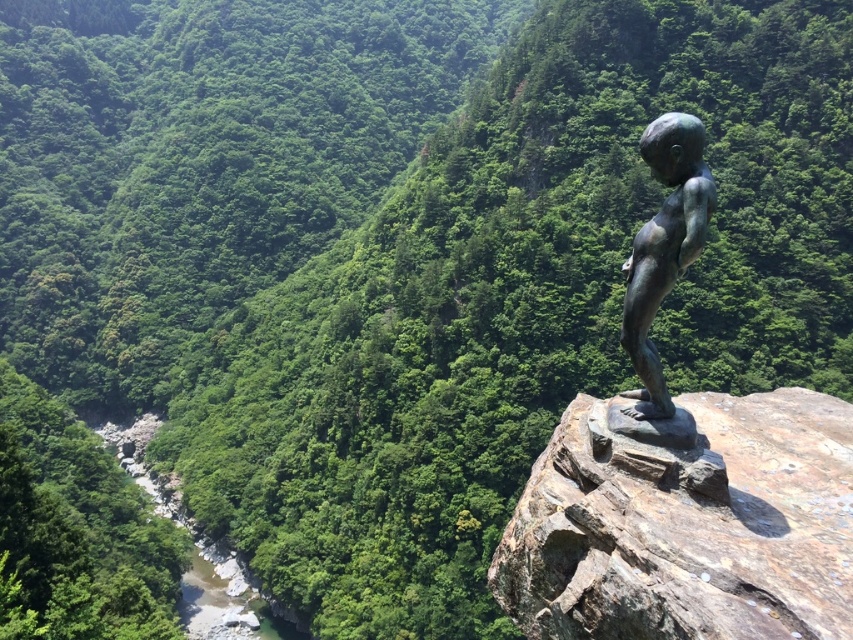
You are an archaeologist examining the landscape. You notice a point at coordinates (686, 524). What object is located there?

The point at (686, 524) is where the rusty metallic statue at upper right is located.

You are an art conservator evaluating two statues in a natural setting. You need to determine which statue requires more immediate attention based on their sizes. The statues are the rusty metallic statue at upper right and the bronze statue at center. Which statue is smaller and thus might need more focused care due to its size?

The rusty metallic statue at upper right has a smaller size compared to bronze statue at center, so it might need more focused care due to its size.

You are a hiker who wants to take a photo of both the rusty metallic statue at upper right and the bronze statue at center. Which statue should you move closer to in order to have both in the frame?

To include both the rusty metallic statue at upper right and the bronze statue at center in your photo, you should move closer to the bronze statue at center since the rusty metallic statue at upper right is positioned to its left side, allowing both to be captured within the frame when centered on the bronze statue.